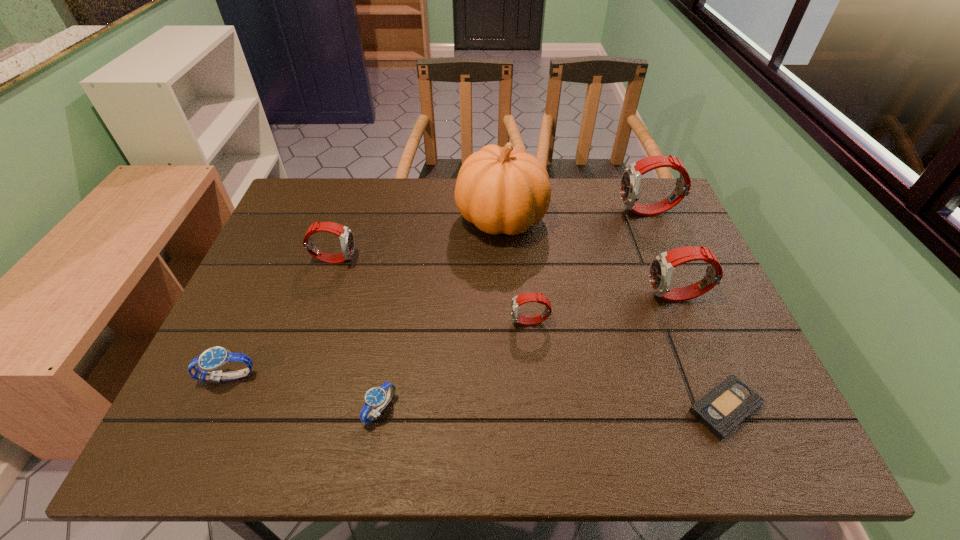
Where is `the leftmost object`? the leftmost object is located at coordinates tap(213, 358).

You are a GUI agent. You are given a task and a screenshot of the screen. Output one action in this format:
    pyautogui.click(x=<x>, y=<y>)
    Task: Click on the third shortest object
    This screenshot has height=540, width=960.
    Given the screenshot: What is the action you would take?
    pyautogui.click(x=213, y=358)

Locate an element on the screen. This screenshot has height=540, width=960. the third object from left to right is located at coordinates (376, 397).

Where is `the right blue watch`? the right blue watch is located at coordinates (376, 397).

Locate an element on the screen. The image size is (960, 540). the shortest object is located at coordinates (721, 410).

Identify the location of vacant area located 0.100m on the right of the pumpkin. (581, 219).

In order to click on free point located on the face of the biggest red watch in this screenshot , I will do `click(520, 212)`.

This screenshot has width=960, height=540. Identify the location of vacant space located 0.100m on the face of the biggest red watch. (586, 212).

Where is `vacant space located 0.350m on the face of the biggest red watch`? The width and height of the screenshot is (960, 540). vacant space located 0.350m on the face of the biggest red watch is located at coordinates (504, 212).

Find the location of a particular element. This screenshot has width=960, height=540. free space located 0.290m on the face of the second tallest watch is located at coordinates (532, 296).